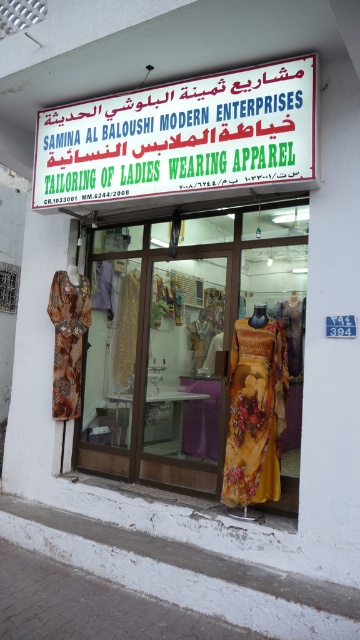
Who is taller, floral fabric dress at center or floral silk dress at center?

floral fabric dress at center

The image size is (360, 640). Find the location of `floral fabric dress at center`. floral fabric dress at center is located at coordinates (200, 356).

This screenshot has height=640, width=360. Find the location of `floral fabric dress at center`. floral fabric dress at center is located at coordinates (200, 356).

Is point (181, 424) less distant than point (57, 323)?

No, (181, 424) is further to viewer.

Is floral fabric dress at center below floral silk dress at left?

Yes, floral fabric dress at center is below floral silk dress at left.

The height and width of the screenshot is (640, 360). Describe the element at coordinates (200, 356) in the screenshot. I see `floral fabric dress at center` at that location.

The height and width of the screenshot is (640, 360). I want to click on floral fabric dress at center, so click(x=200, y=356).

Does white plastic sign at upper center appear on the left side of floral silk dress at left?

Incorrect, white plastic sign at upper center is not on the left side of floral silk dress at left.

Does white plastic sign at upper center appear on the right side of floral silk dress at left?

Yes, white plastic sign at upper center is to the right of floral silk dress at left.

Between point (276, 65) and point (64, 298), which one is positioned behind?

Point (64, 298)

In order to click on white plastic sign at upper center in this screenshot , I will do `click(181, 140)`.